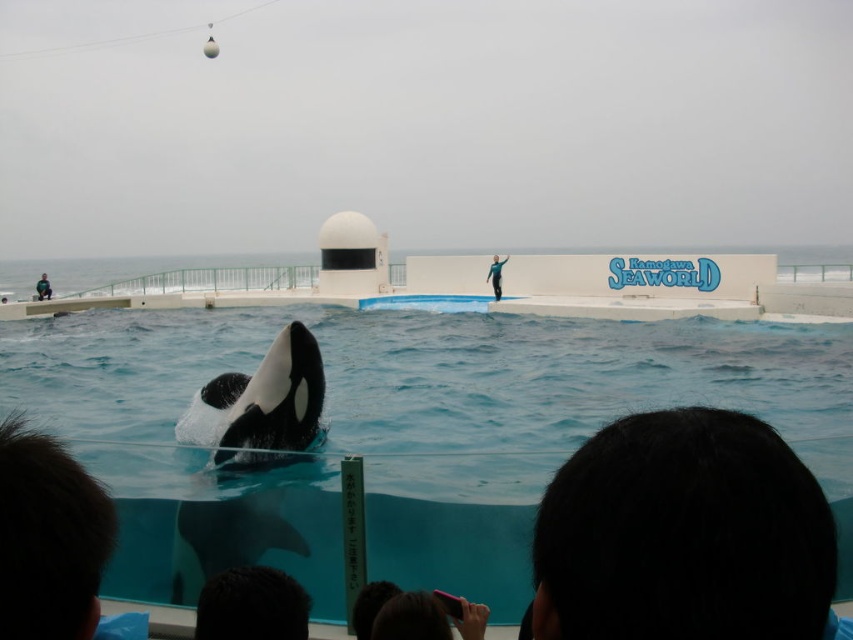
Question: Is black hair at lower right wider than blue fabric at upper center?

Choices:
 (A) no
 (B) yes

Answer: (B)

Question: Where is black hair at lower right located in relation to black smooth whale at center in the image?

Choices:
 (A) left
 (B) right

Answer: (B)

Question: Which of the following is the farthest from the observer?

Choices:
 (A) black hair at lower right
 (B) dark hair at lower center
 (C) black smooth whale at center

Answer: (C)

Question: Is black smooth whale at center positioned before dark blue wetsuit at lower left?

Choices:
 (A) no
 (B) yes

Answer: (B)

Question: Which object is closer to the camera taking this photo?

Choices:
 (A) black matte hair at lower left
 (B) dark blue wetsuit at lower left

Answer: (A)

Question: Estimate the real-world distances between objects in this image. Which object is closer to the black matte hair at lower left?

Choices:
 (A) dark blue wetsuit at lower left
 (B) dark hair at lower center

Answer: (B)